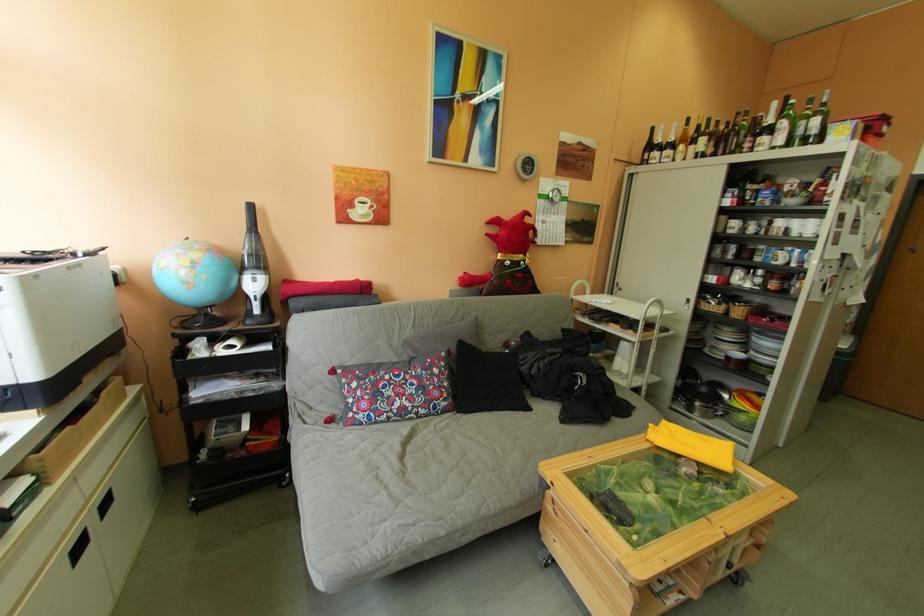
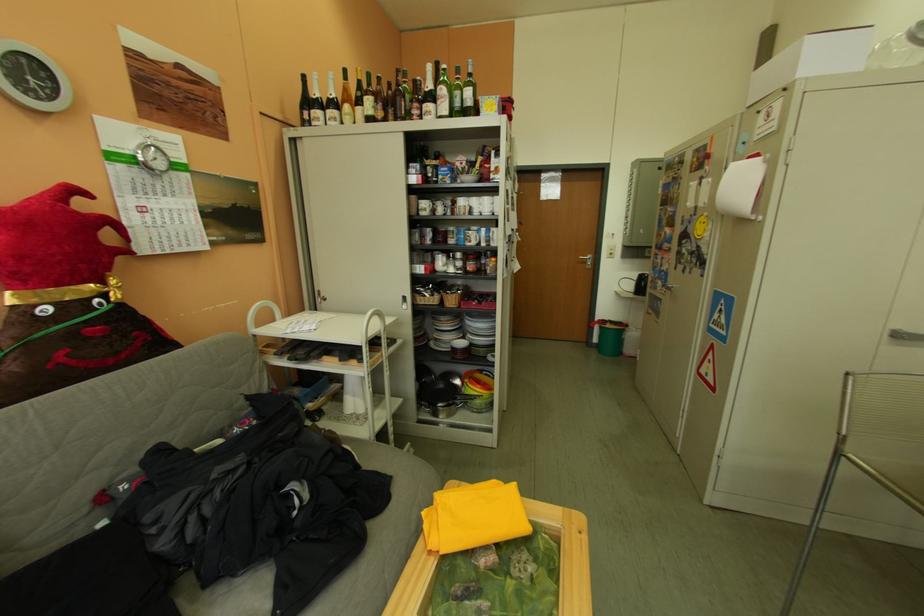
The point at (796, 232) is marked in the first image. Where is the corresponding point in the second image?

(481, 211)